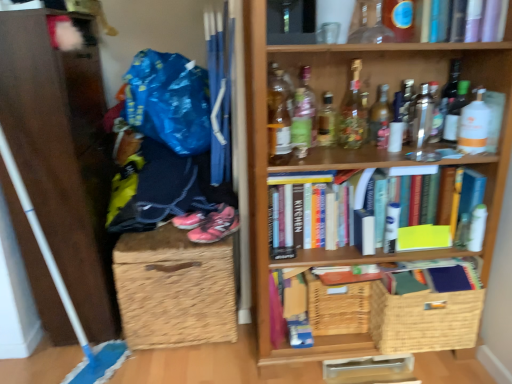
Where is `free space above woven wood basket at lower center, the 1th basket positioned from the left (from a real-world perspective)`? This screenshot has width=512, height=384. free space above woven wood basket at lower center, the 1th basket positioned from the left (from a real-world perspective) is located at coordinates (351, 267).